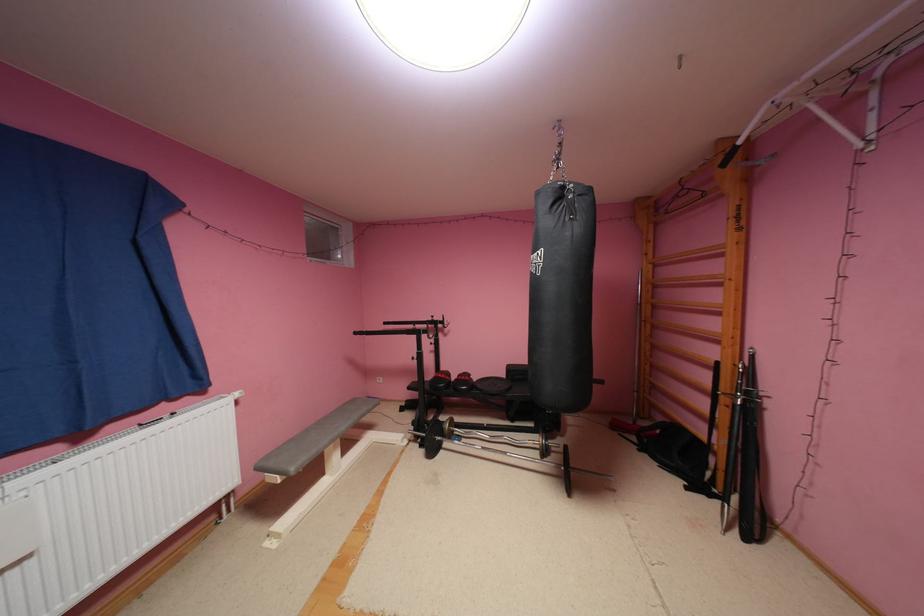
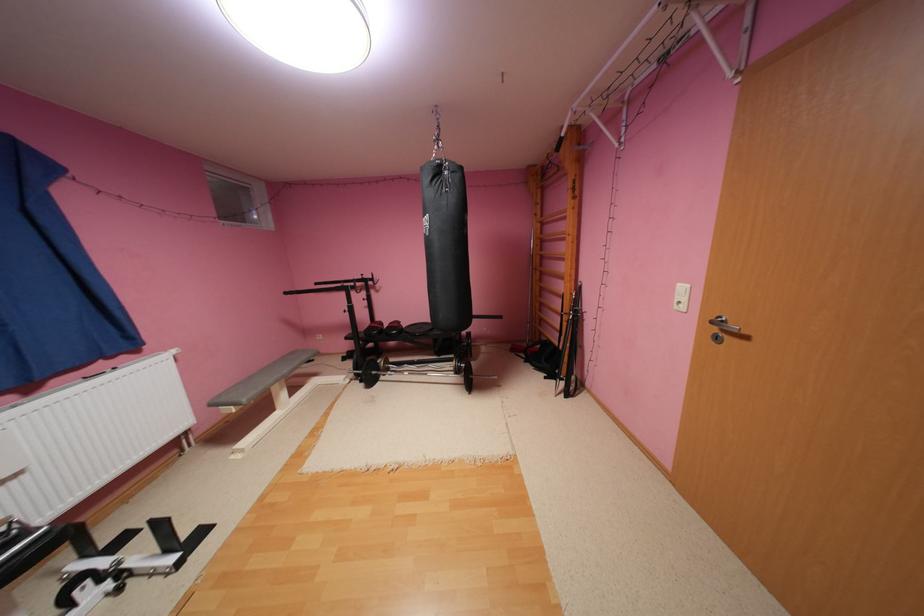
Find the pixel in the second image that matches point (280, 464) in the first image.

(233, 399)